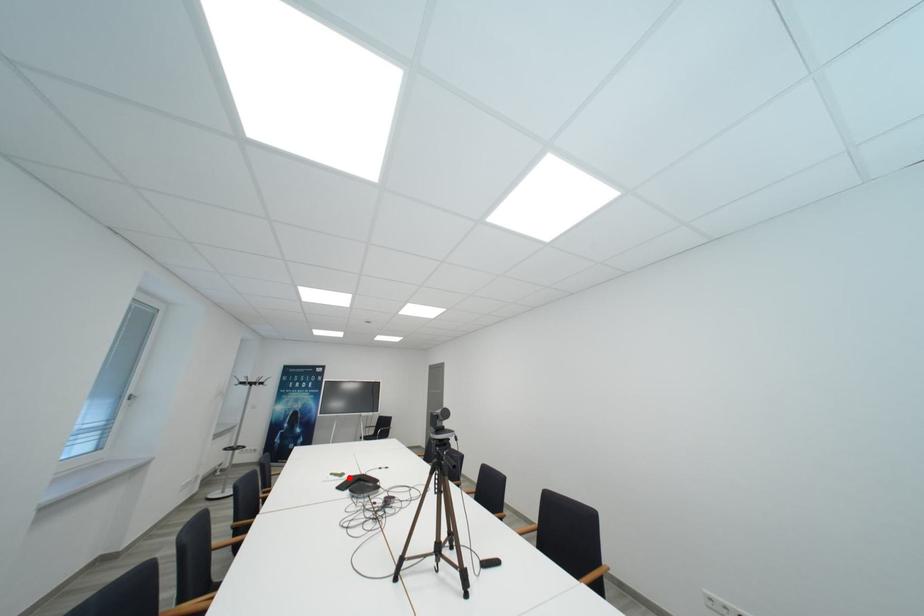
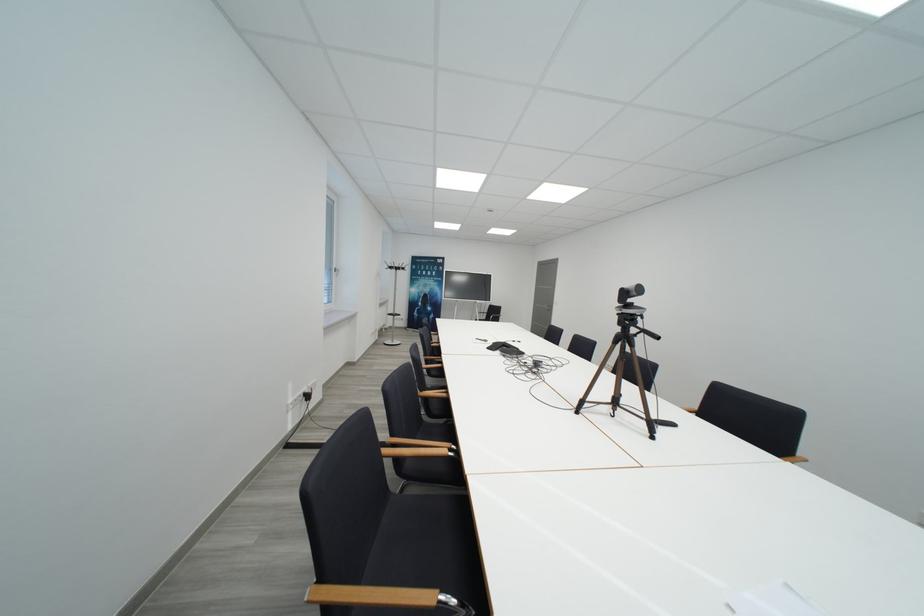
Question: I am providing you with two images of the same scene from different viewpoints. Given a red point in image1, look at the same physical point in image2. Is it:

Choices:
 (A) Closer to the viewpoint
 (B) Farther from the viewpoint

Answer: (B)